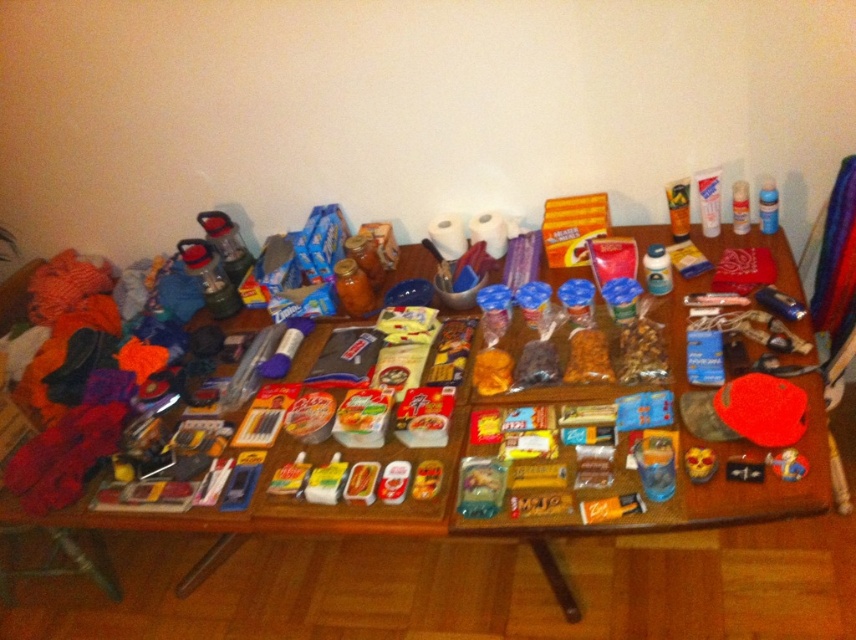
You are packing for a camping trip and have a limited space in your backpack. You need to decide between placing the wooden table at center or the brown crumbly snack at center into your backpack. Which item should you choose to take based on their proximity to the center of the table?

Answer: The brown crumbly snack at center is closer to the center of the table than the wooden table at center. However, the wooden table at center is likely a non portable item, so you should take the brown crumbly snack at center.